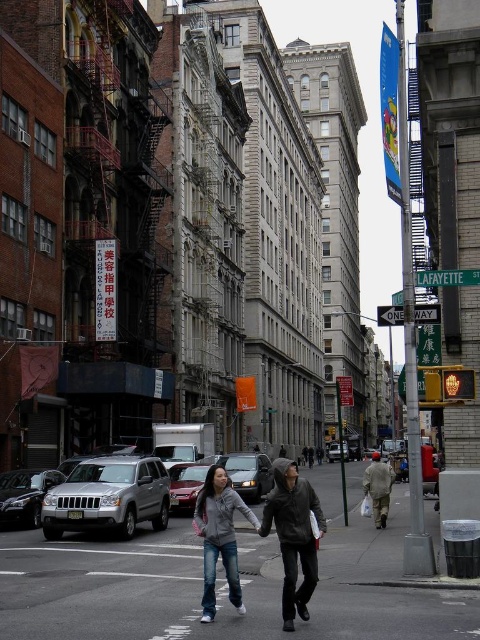
Question: Is silver metallic suv at lower left to the right of silver metallic sedan at center from the viewer's perspective?

Choices:
 (A) no
 (B) yes

Answer: (A)

Question: Where is silver metallic sedan at center located in relation to gray hoodie at center in the image?

Choices:
 (A) right
 (B) left

Answer: (A)

Question: Among these objects, which one is nearest to the camera?

Choices:
 (A) gray cotton hoodie at center
 (B) gray hoodie at center
 (C) silver metallic sedan at center
 (D) silver metallic suv at lower left

Answer: (A)

Question: Is denim jacket at center thinner than metallic silver sedan at center?

Choices:
 (A) no
 (B) yes

Answer: (B)

Question: Estimate the real-world distances between objects in this image. Which object is farther from the denim jacket at center?

Choices:
 (A) silver metallic sedan at center
 (B) gray cotton hoodie at center

Answer: (A)

Question: Estimate the real-world distances between objects in this image. Which object is farther from the silver metallic sedan at center?

Choices:
 (A) silver metallic suv at lower left
 (B) gray cotton hoodie at center

Answer: (A)